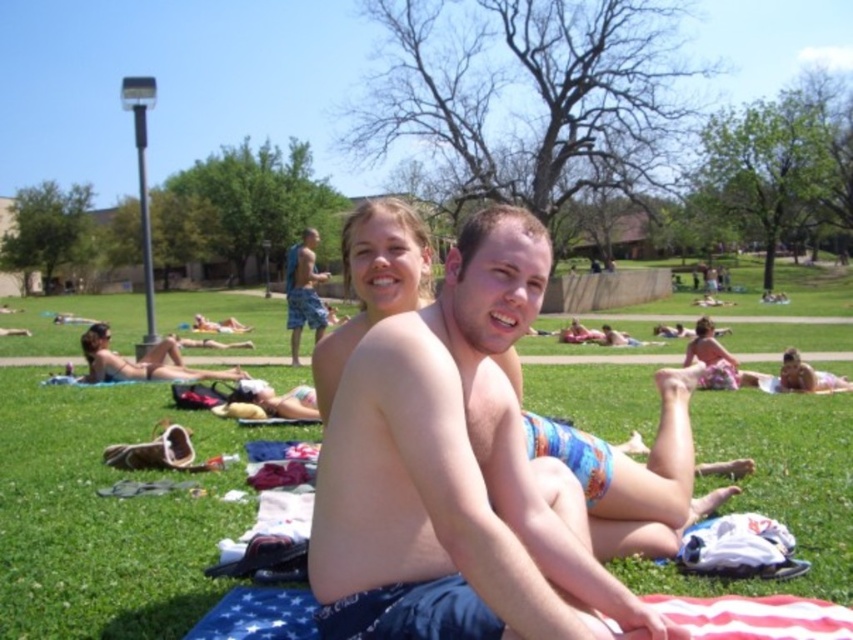
Question: Which object appears closest to the camera in this image?

Choices:
 (A) green grass at center
 (B) matte bikini at center

Answer: (A)

Question: Is green grass at center wider than blue swim trunks at center?

Choices:
 (A) no
 (B) yes

Answer: (B)

Question: Which of the following is the farthest from the observer?

Choices:
 (A) (190, 374)
 (B) (527, 305)
 (C) (233, 444)

Answer: (A)

Question: Among these points, which one is farthest from the camera?

Choices:
 (A) (386, 536)
 (B) (546, 339)
 (C) (314, 257)
 (D) (86, 349)

Answer: (B)

Question: Is green grass at center above blue swim trunks at center?

Choices:
 (A) no
 (B) yes

Answer: (B)

Question: Is green grass at center above matte bikini at center?

Choices:
 (A) yes
 (B) no

Answer: (A)